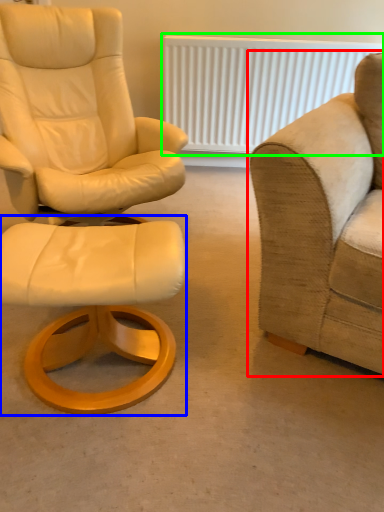
Question: Considering the real-world distances, which object is closest to studio couch (highlighted by a red box)? stool (highlighted by a blue box) or radiator (highlighted by a green box).

Choices:
 (A) stool
 (B) radiator

Answer: (A)